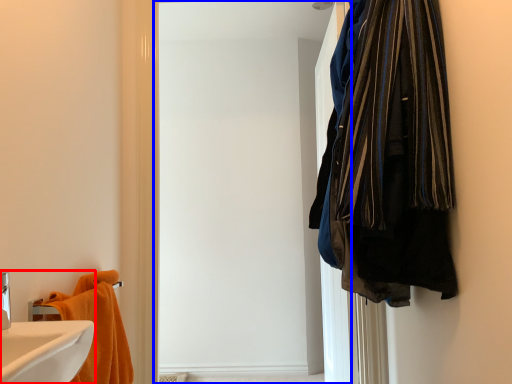
Question: Among these objects, which one is nearest to the camera, bathroom cabinet (highlighted by a red box) or screen door (highlighted by a blue box)?

Choices:
 (A) bathroom cabinet
 (B) screen door

Answer: (A)